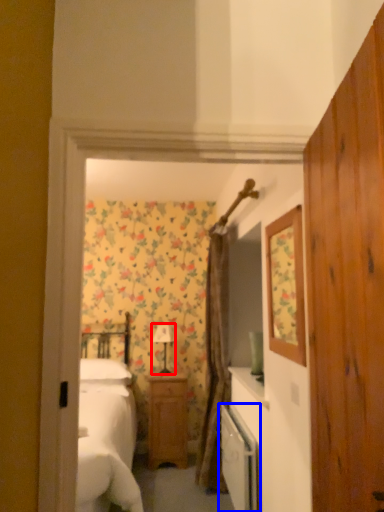
Question: Which of the following is the farthest to the observer, lamp (highlighted by a red box) or dish washer (highlighted by a blue box)?

Choices:
 (A) lamp
 (B) dish washer

Answer: (A)